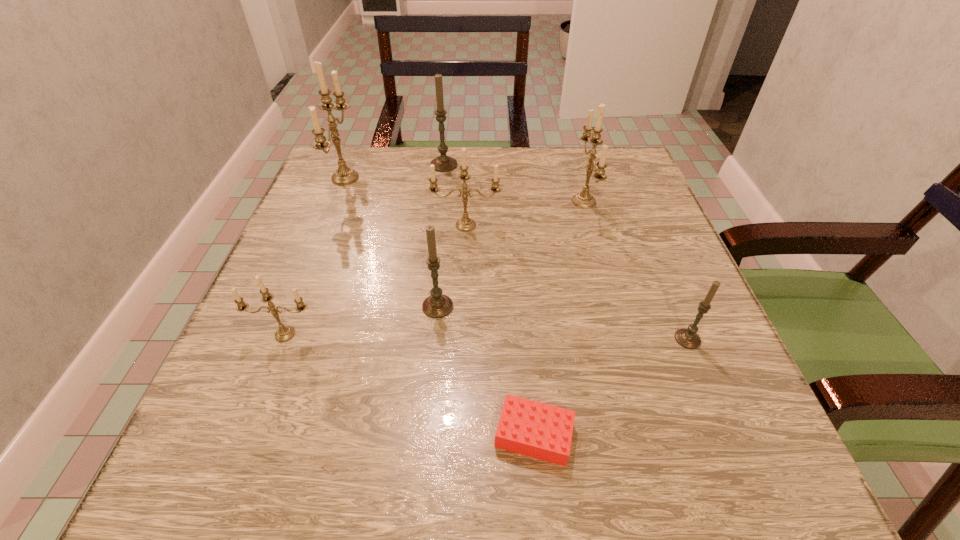
I want to click on free space that satisfies the following two spatial constraints: 1. on the front side of the second smallest metallic candle; 2. on the left side of the nearest object, so click(458, 435).